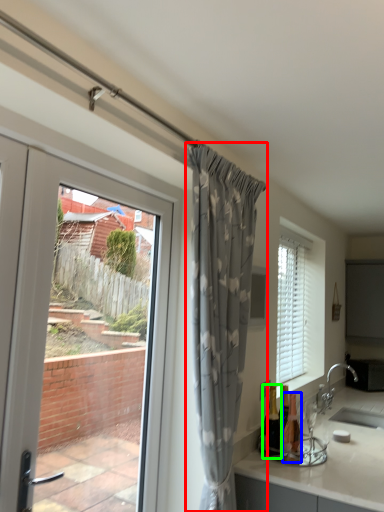
Question: Which object is positioned closest to curtain (highlighted by a red box)? Select from bottle (highlighted by a blue box) and bottle (highlighted by a green box).

Choices:
 (A) bottle
 (B) bottle

Answer: (B)